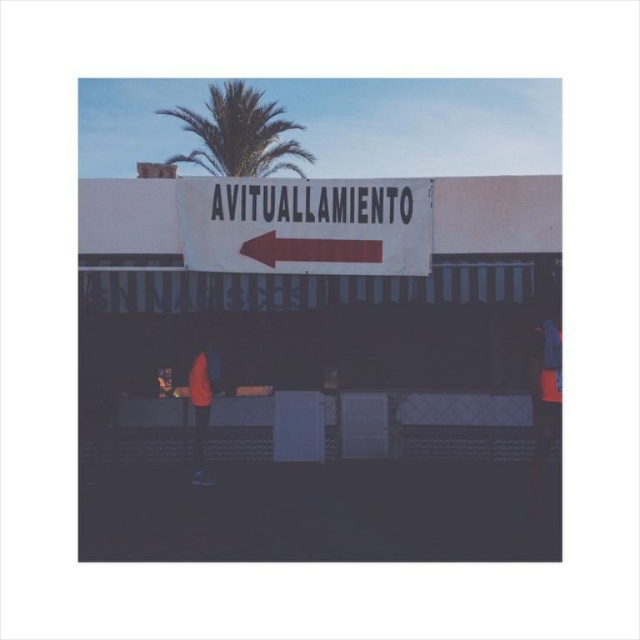
Between green leafy palm tree at upper center and matte orange shirt at center, which one appears on the right side from the viewer's perspective?

Positioned to the right is matte orange shirt at center.

From the picture: Who is shorter, green leafy palm tree at upper center or matte orange shirt at center?

matte orange shirt at center

This screenshot has height=640, width=640. I want to click on green leafy palm tree at upper center, so click(240, 132).

Does white matte sign at center have a larger size compared to matte orange shirt at center?

No.

Image resolution: width=640 pixels, height=640 pixels. What do you see at coordinates (307, 225) in the screenshot?
I see `white matte sign at center` at bounding box center [307, 225].

Between point (365, 198) and point (195, 368), which one is positioned behind?

Point (195, 368)

Identify the location of white matte sign at center. This screenshot has width=640, height=640. (307, 225).

Find the location of `white matte sign at center`. white matte sign at center is located at coordinates (307, 225).

What do you see at coordinates (307, 225) in the screenshot? The width and height of the screenshot is (640, 640). I see `white matte sign at center` at bounding box center [307, 225].

The width and height of the screenshot is (640, 640). Identify the location of white matte sign at center. point(307,225).